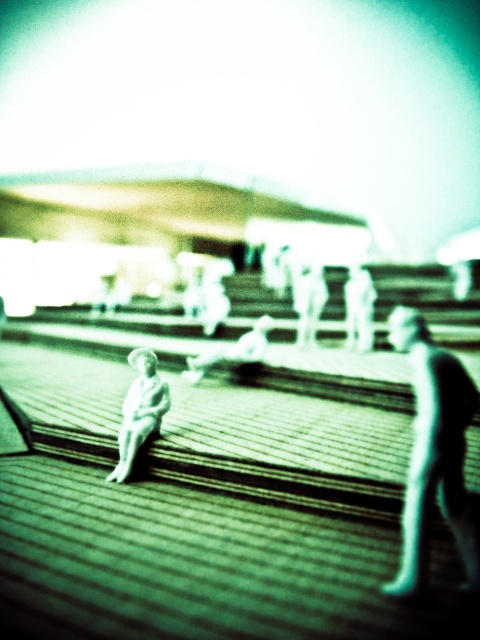
Who is more forward, (420, 412) or (162, 404)?

Point (420, 412)

Where is `smooth black figure at right`? smooth black figure at right is located at coordinates (433, 452).